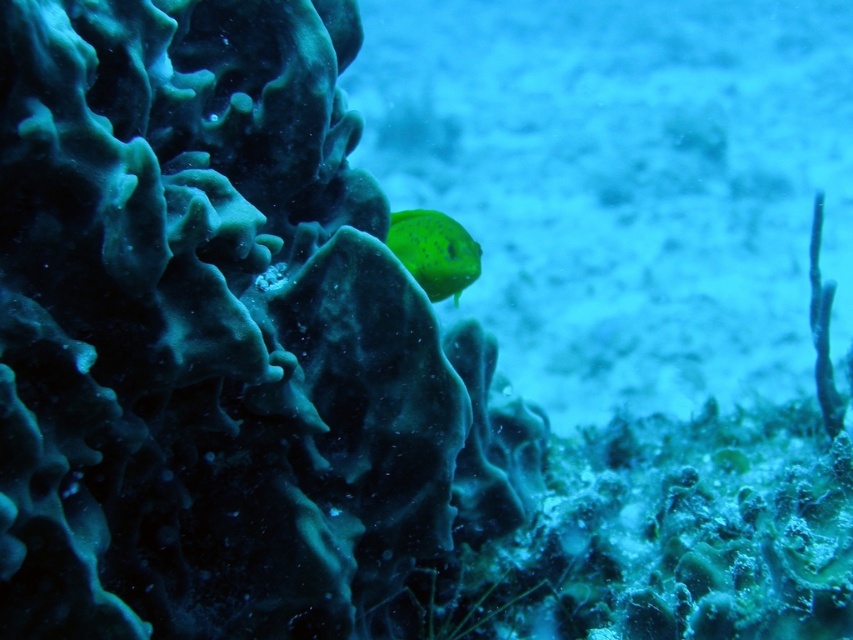
You are a marine biologist observing this underwater scene. You notice the translucent green water at center and the green matte fish at upper center. Based on their positions, which object is closer to the surface of the water?

The translucent green water at center is above the green matte fish at upper center, so it is closer to the surface of the water.

You are a marine biologist studying the coral reef. You observe the translucent green water at center and the green matte fish at upper center. Which object is positioned higher in the image?

The green matte fish at upper center is positioned higher in the image because it is located at the upper center, while the translucent green water at center is lower.

Looking at this image, you are a marine biologist studying underwater visibility. You observe the green matte fish at upper center and the translucent green water at center. Which object is closer to the camera?

The translucent green water at center is closer to the camera than the green matte fish at upper center, as the fish is positioned behind the water.